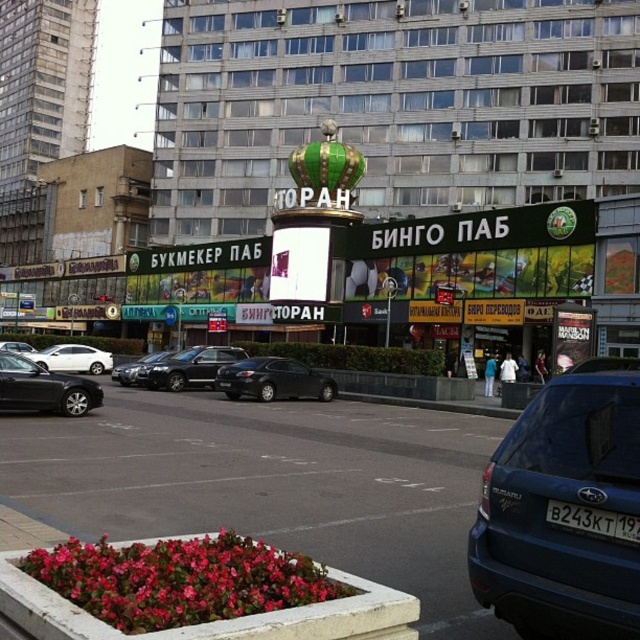
Question: From the image, what is the correct spatial relationship of shiny silver sedan at center in relation to silver metallic sedan at center?

Choices:
 (A) right
 (B) left

Answer: (A)

Question: Estimate the real-world distances between objects in this image. Which object is closer to the matte black sedan at center?

Choices:
 (A) satin black car at center
 (B) silver metallic sedan at center
 (C) shiny black sedan at left
 (D) white plastic license plate at lower right

Answer: (A)

Question: Estimate the real-world distances between objects in this image. Which object is farther from the shiny silver sedan at center?

Choices:
 (A) white matte sedan at center-left
 (B) shiny black sedan at left

Answer: (B)

Question: Is blue matte suv at lower right above matte black sedan at center?

Choices:
 (A) yes
 (B) no

Answer: (A)

Question: Which object is the closest to the silver metallic sedan at center?

Choices:
 (A) matte black sedan at center
 (B) shiny black sedan at left

Answer: (A)

Question: Does shiny black sedan at left have a larger size compared to white plastic license plate at lower right?

Choices:
 (A) no
 (B) yes

Answer: (B)